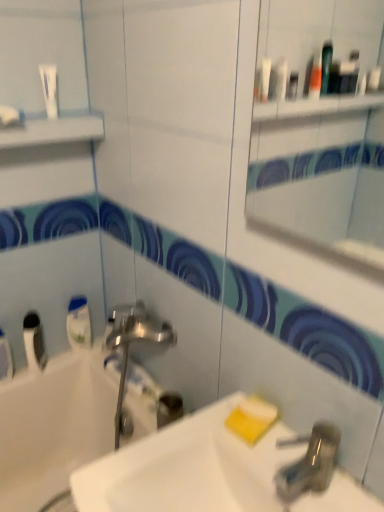
Locate an element on the screen. Image resolution: width=384 pixels, height=512 pixels. vacant space in between white glossy mouthwash at left, the second mouthwash when ordered from left to right, and white opaque tube at lower left, arranged as the 1th mouthwash when viewed from the left is located at coordinates (68, 356).